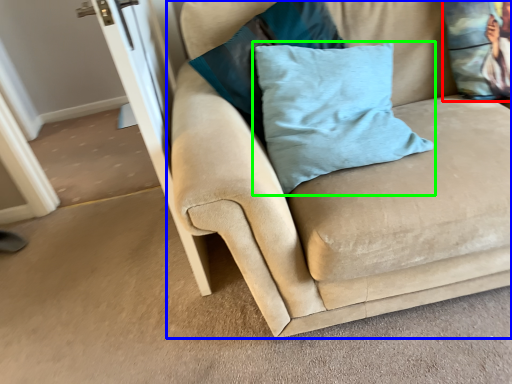
Question: Which object is positioned farthest from pillow (highlighted by a red box)? Select from studio couch (highlighted by a blue box) and pillow (highlighted by a green box).

Choices:
 (A) studio couch
 (B) pillow

Answer: (B)